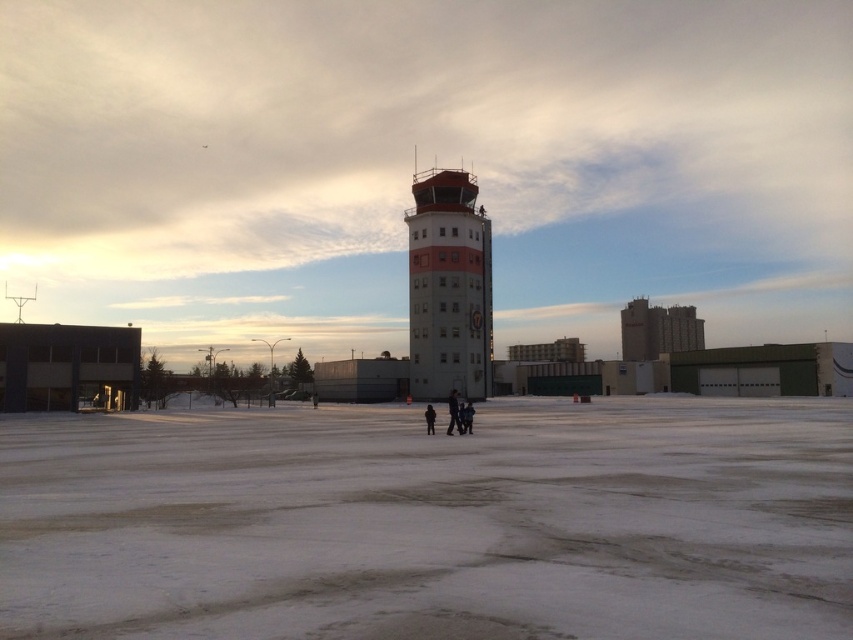
Question: Which object is farther from the camera taking this photo?

Choices:
 (A) white powdery snow at center
 (B) white concrete control tower at center

Answer: (B)

Question: Does white powdery snow at center come in front of white concrete control tower at center?

Choices:
 (A) no
 (B) yes

Answer: (B)

Question: Can you confirm if white powdery snow at center is positioned to the left of white concrete control tower at center?

Choices:
 (A) no
 (B) yes

Answer: (B)

Question: Which object appears farthest from the camera in this image?

Choices:
 (A) white concrete control tower at center
 (B) white powdery snow at center

Answer: (A)

Question: Is white powdery snow at center above white concrete control tower at center?

Choices:
 (A) yes
 (B) no

Answer: (B)